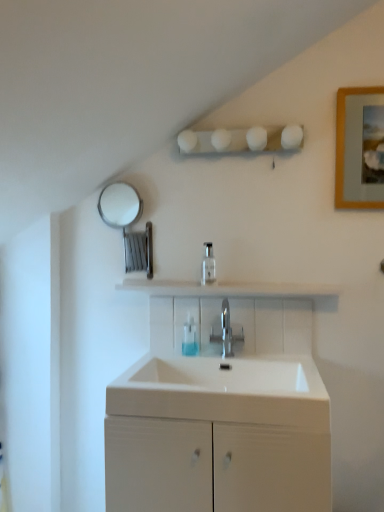
Locate an element on the screen. This screenshot has width=384, height=512. vacant space to the left of white glossy soap dispenser at center is located at coordinates (181, 282).